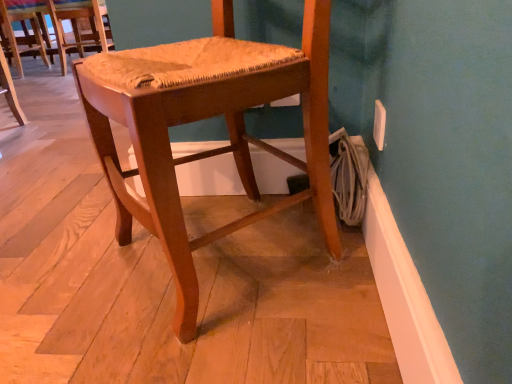
You are a GUI agent. You are given a task and a screenshot of the screen. Output one action in this format:
    pyautogui.click(x=<x>, y=<y>)
    Task: Click on the vacant area that is in front of wooden woven seat at center, the first chair when ordered from bottom to top
    This screenshot has width=512, height=384.
    Given the screenshot: What is the action you would take?
    pyautogui.click(x=227, y=338)